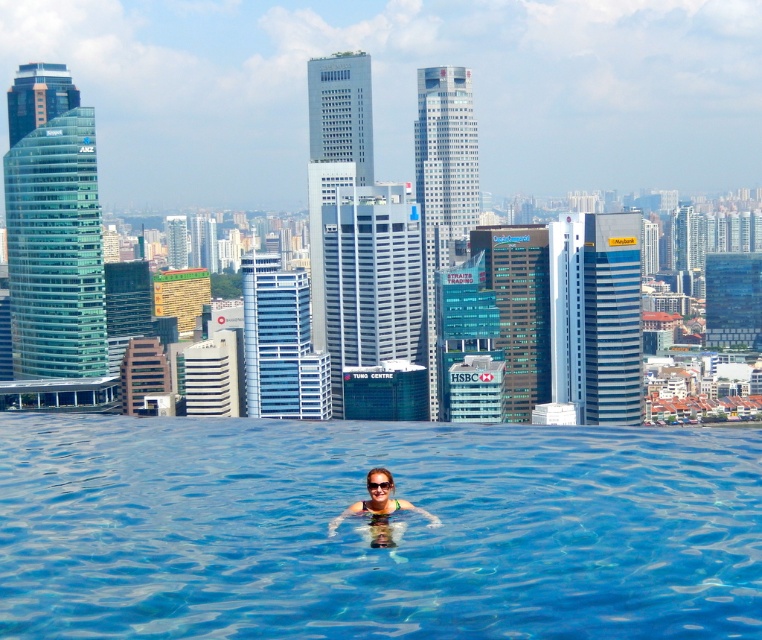
Describe the element at coordinates (376, 500) in the screenshot. I see `matte black swimsuit at center` at that location.

Does matte black swimsuit at center have a lesser height compared to transparent plastic goggles at center?

In fact, matte black swimsuit at center may be taller than transparent plastic goggles at center.

Which is in front, point (370, 468) or point (388, 483)?

Point (388, 483)

Identify the location of matte black swimsuit at center. (376, 500).

Who is higher up, transparent blue water at center or matte black swimsuit at center?

Positioned higher is matte black swimsuit at center.

Is transparent blue water at center further to the viewer compared to matte black swimsuit at center?

No, it is in front of matte black swimsuit at center.

Is point (402, 620) behind point (338, 518)?

No, it is in front of (338, 518).

Image resolution: width=762 pixels, height=640 pixels. In order to click on transparent blue water at center in this screenshot , I will do `click(367, 531)`.

Based on the photo, who is positioned more to the right, transparent blue water at center or transparent plastic goggles at center?

From the viewer's perspective, transparent plastic goggles at center appears more on the right side.

Which is below, transparent blue water at center or transparent plastic goggles at center?

transparent blue water at center is below.

In the scene shown: Who is more forward, (396, 470) or (383, 484)?

Point (383, 484) is more forward.

Find the location of a particular element. transparent blue water at center is located at coordinates (367, 531).